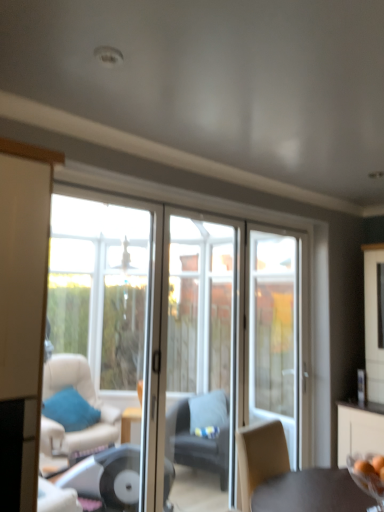
Question: Is clear glass screen door at center, marked as the second screen door in a right-to-left arrangement, wider or thinner than dark gray fabric chair at center?

Choices:
 (A) thin
 (B) wide

Answer: (A)

Question: Is point (193, 251) closer or farther from the camera than point (200, 423)?

Choices:
 (A) farther
 (B) closer

Answer: (A)

Question: Estimate the real-world distances between objects in this image. Which object is closer to the clear glass door at center, the second screen door in the left-to-right sequence?

Choices:
 (A) dark gray fabric chair at center
 (B) white glass door at center
 (C) transparent glass bowl at lower right
 (D) transparent glass window at left
 (E) blue fabric pillow at lower left

Answer: (B)

Question: Based on their relative distances, which object is nearer to the blue fabric pillow at lower left?

Choices:
 (A) transparent glass window at left
 (B) dark gray fabric chair at center
 (C) white glass door at center
 (D) clear glass door at center, which is the first screen door in right-to-left order
 (E) transparent glass bowl at lower right

Answer: (B)